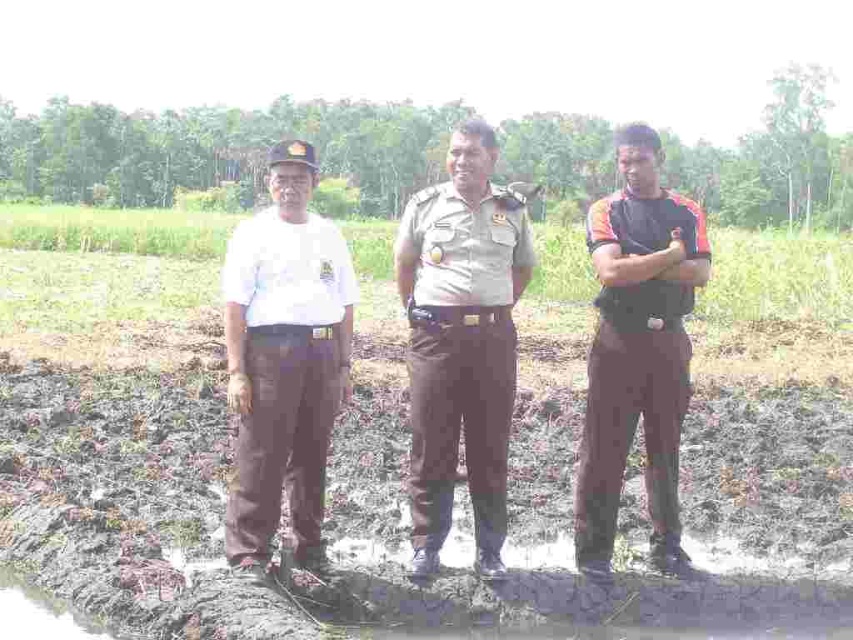
Question: Which of the following is the closest to the observer?

Choices:
 (A) (695, 211)
 (B) (328, 440)
 (C) (436, 442)

Answer: (C)

Question: Estimate the real-world distances between objects in this image. Which object is closer to the white matte shirt at center?

Choices:
 (A) dark brown uniform at center
 (B) light brown uniform at center

Answer: (B)

Question: Can you confirm if white matte shirt at center is positioned above dark brown uniform at center?

Choices:
 (A) no
 (B) yes

Answer: (A)

Question: Can you confirm if white matte shirt at center is positioned above dark brown uniform at center?

Choices:
 (A) no
 (B) yes

Answer: (A)

Question: Among these points, which one is nearest to the camera?

Choices:
 (A) (424, 195)
 (B) (317, 355)
 (C) (595, 467)

Answer: (B)

Question: From the image, what is the correct spatial relationship of light brown uniform at center in relation to white matte shirt at center?

Choices:
 (A) below
 (B) above

Answer: (B)